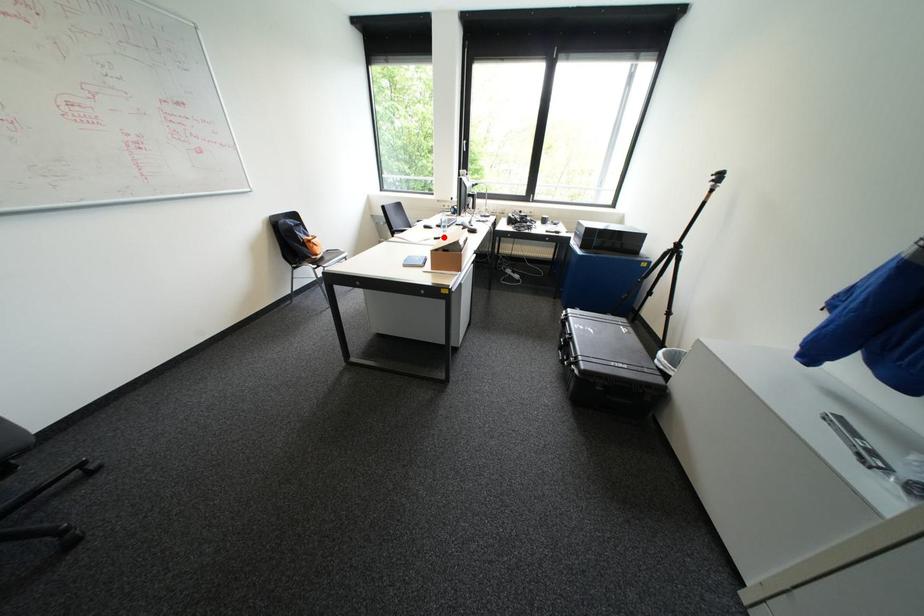
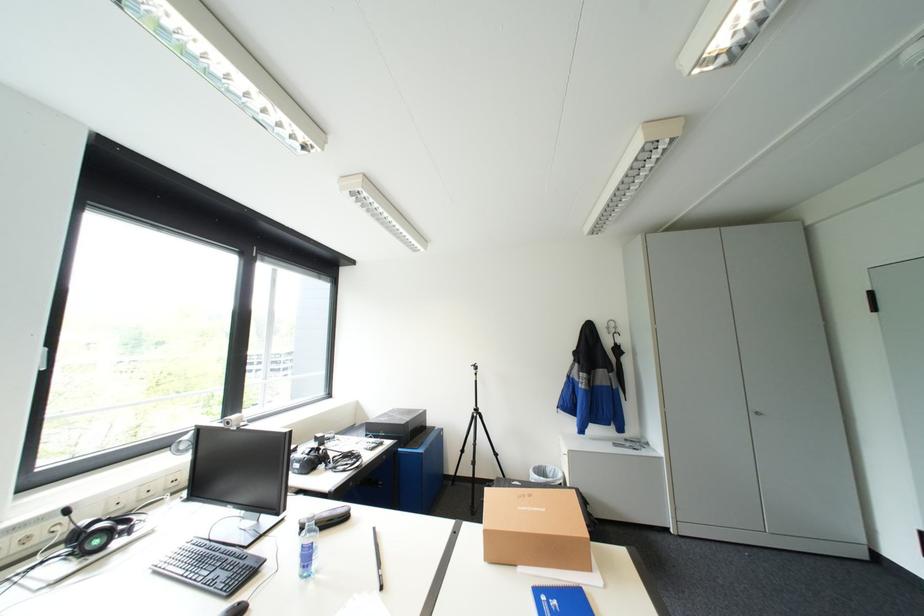
Question: I am providing you with two images of the same scene from different viewpoints. A red point is marked on the first image. Can you still see the location of the red point in image 2?

Choices:
 (A) Yes
 (B) No

Answer: (B)